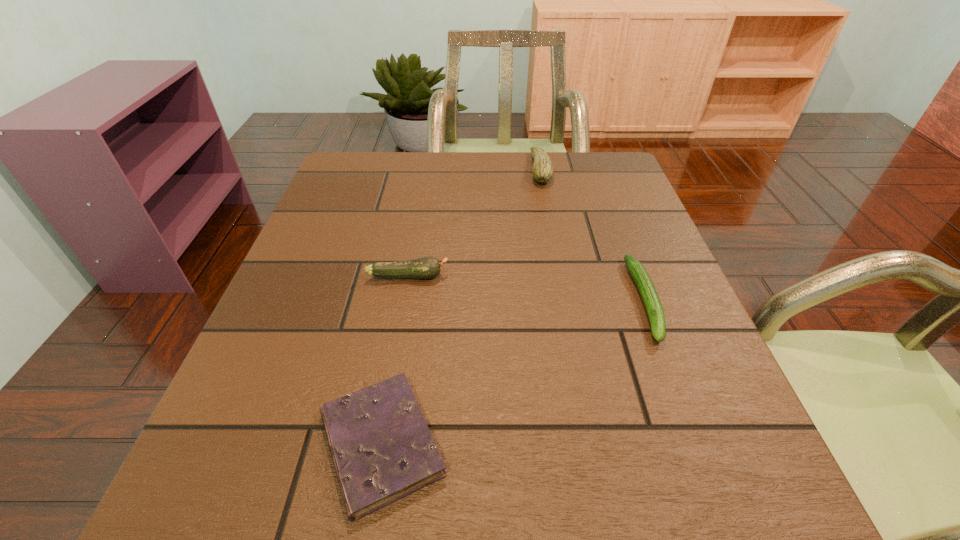
At what (x,y) coordinates should I click in order to perform the action: click on the tallest zucchini. Please return your answer as a coordinate pair (x, y). This screenshot has width=960, height=540. Looking at the image, I should click on (542, 170).

What are the coordinates of `the tallest object` in the screenshot? It's located at (542, 170).

Locate an element on the screen. the leftmost zucchini is located at coordinates (426, 267).

Where is `the second tallest zucchini`? The height and width of the screenshot is (540, 960). the second tallest zucchini is located at coordinates (426, 267).

Image resolution: width=960 pixels, height=540 pixels. What are the coordinates of `the shortest zucchini` in the screenshot? It's located at (649, 295).

At what (x,y) coordinates should I click in order to perform the action: click on the rightmost object. Please return your answer as a coordinate pair (x, y). Looking at the image, I should click on (649, 295).

The width and height of the screenshot is (960, 540). Find the location of `diary`. diary is located at coordinates coord(382,449).

Find the location of `the nearest object`. the nearest object is located at coordinates (382, 449).

You are a GUI agent. You are given a task and a screenshot of the screen. Output one action in this format:
    pyautogui.click(x=<x>, y=<y>)
    Task: Click on the blank space located 0.350m at the stem end of the farthest zucchini
    
    Given the screenshot: What is the action you would take?
    pyautogui.click(x=400, y=169)

Locate an element on the screen. vacant position located 0.070m at the stem end of the farthest zucchini is located at coordinates (504, 169).